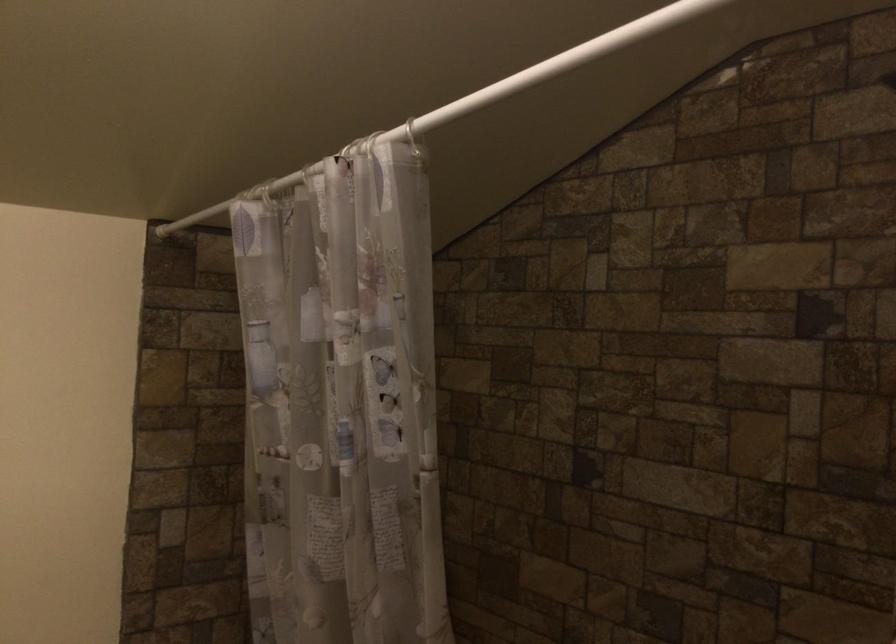
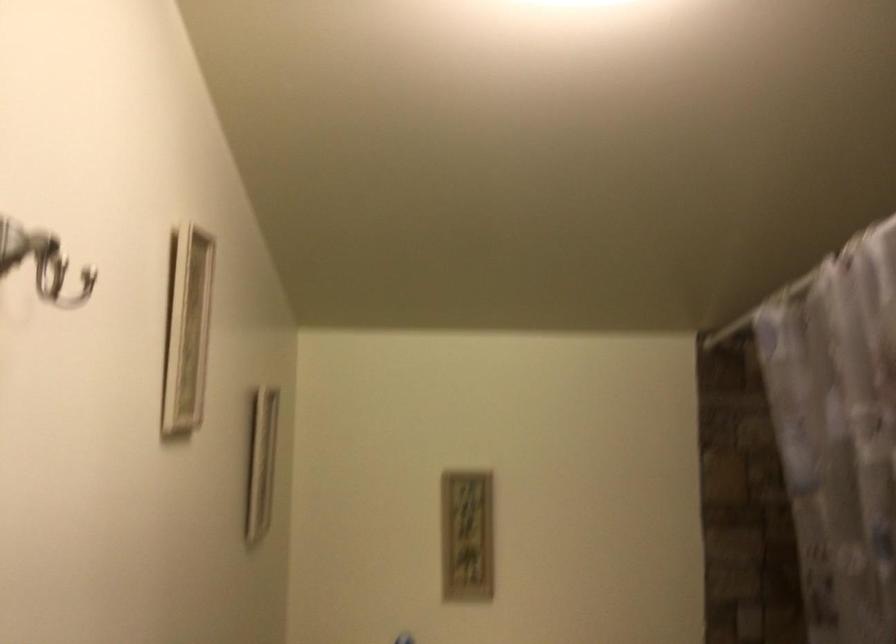
Question: The camera is either moving clockwise (left) or counter-clockwise (right) around the object. The first image is from the beginning of the video and the second image is from the end. Is the camera moving left or right when shooting the video?

Choices:
 (A) Left
 (B) Right

Answer: (B)